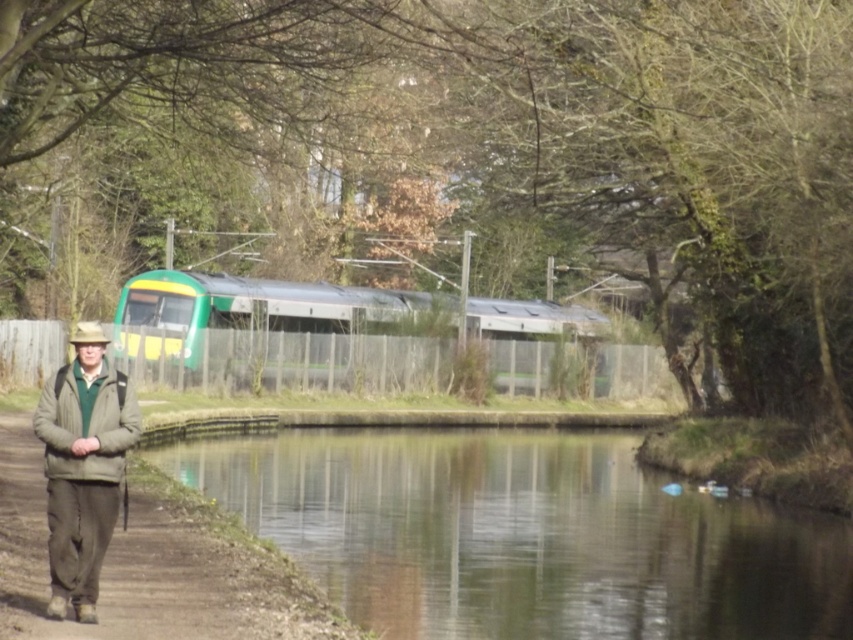
You are a photographer standing on the dull brown dirt path at lower left and want to capture the reflection of the green glassy water at center in your shot. Since the water surface is calm, will tilting your camera slightly downward help you get a better reflection?

The green glassy water at center has a greater height compared to the dull brown dirt path at lower left. Tilting the camera downward may not help because the water surface is higher than the path, so the reflection might already be visible without tilting.

You are standing at the point closer to the viewer. Which point are you at, point (405, 492) or point (39, 433)?

You are at point (405, 492) because it is further to the viewer than point (39, 433).

You are standing at the point with coordinates point (213, 548) and want to move towards the point with coordinates point (415, 509). Which direction should you move relative to the canal?

You should move backward relative to the canal because point (415, 509) is behind point (213, 548).